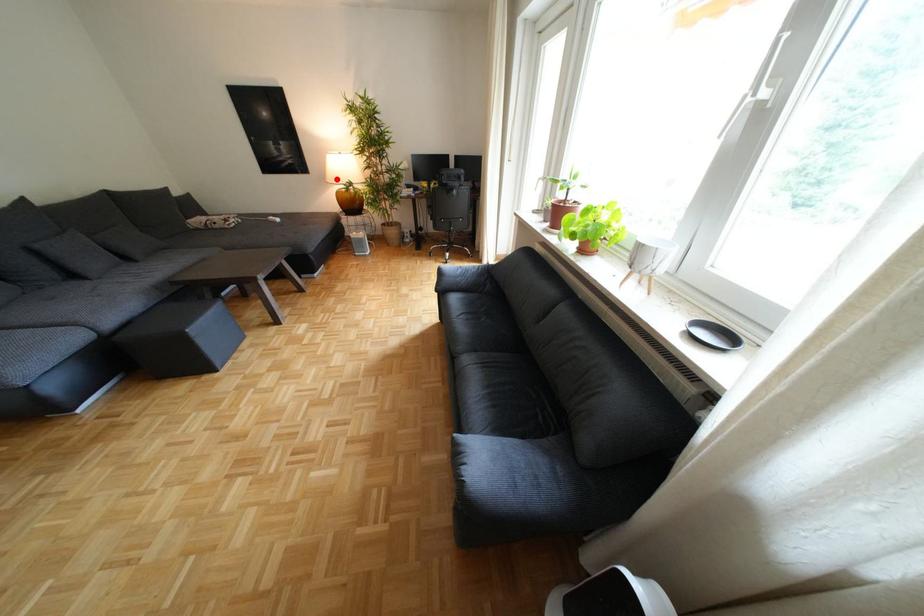
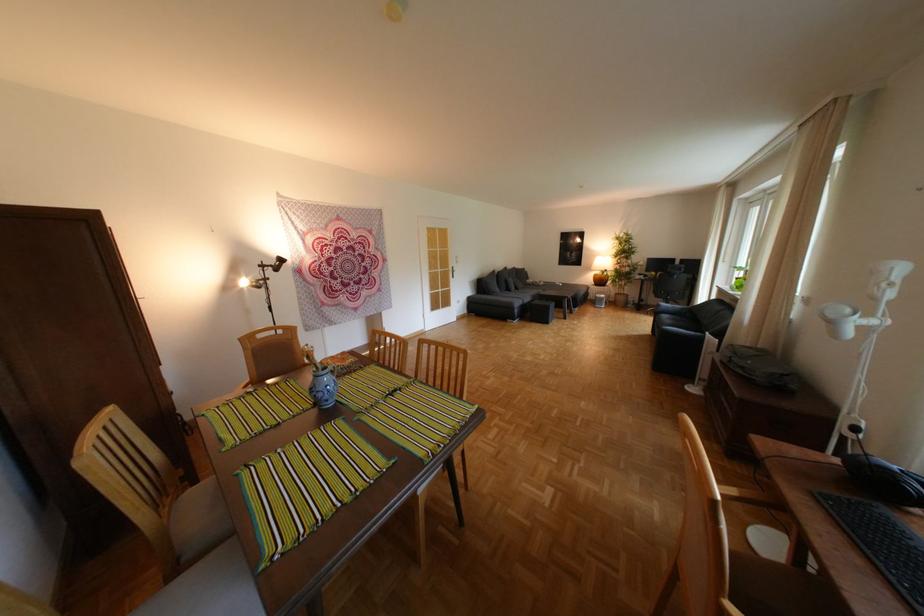
The point at the highlighted location is marked in the first image. Where is the corresponding point in the second image?

(602, 268)